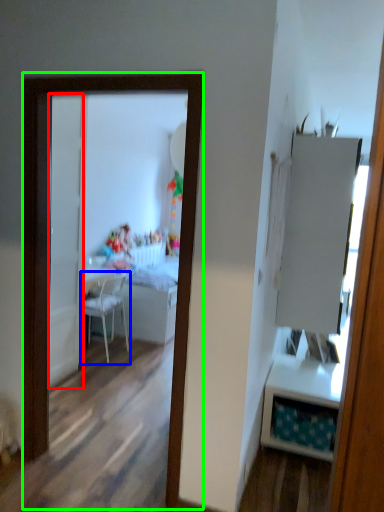
Question: Which is farther away from door (highlighted by a red box)? chair (highlighted by a blue box) or mirror (highlighted by a green box)?

Choices:
 (A) chair
 (B) mirror

Answer: (B)